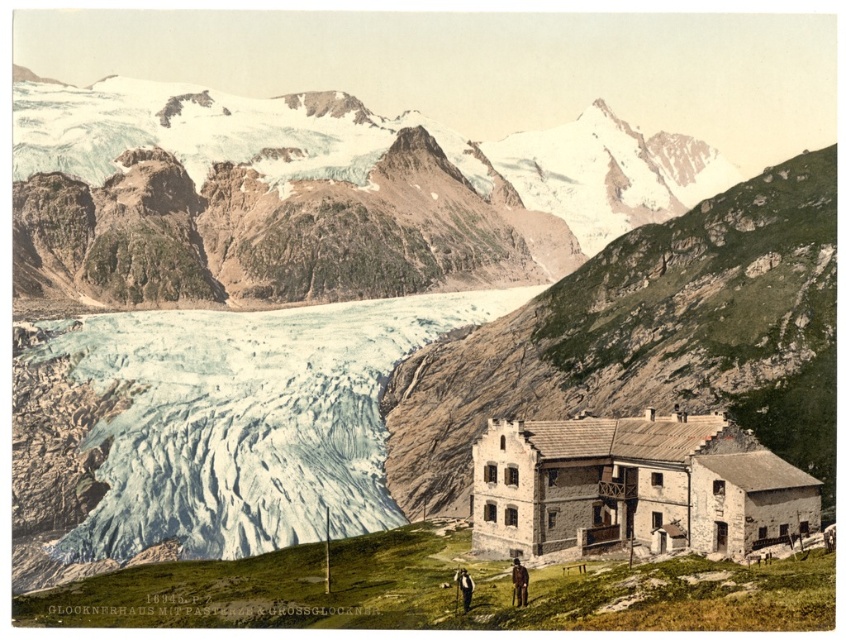
Who is more forward, (x=596, y=109) or (x=515, y=602)?

Point (x=515, y=602) is more forward.

Which of these two, snowy rocky mountain at upper center or brown leather jacket at lower right, stands shorter?

brown leather jacket at lower right

Who is more distant from viewer, (682,156) or (520,596)?

Positioned behind is point (682,156).

The height and width of the screenshot is (640, 846). I want to click on snowy rocky mountain at upper center, so click(x=316, y=196).

Consider the image. Does brown leather jacket at lower right appear on the left side of dark gray wool jacket at lower center?

Incorrect, brown leather jacket at lower right is not on the left side of dark gray wool jacket at lower center.

Is brown leather jacket at lower right wider than dark gray wool jacket at lower center?

Correct, the width of brown leather jacket at lower right exceeds that of dark gray wool jacket at lower center.

At what (x,y) coordinates should I click in order to perform the action: click on brown leather jacket at lower right. Please return your answer as a coordinate pair (x, y). Looking at the image, I should click on 519,582.

Measure the distance between stone textured building at center and camera.

stone textured building at center is 86.16 meters from camera.

Which of these two, stone textured building at center or brown leather jacket at lower right, stands shorter?

Standing shorter between the two is brown leather jacket at lower right.

The height and width of the screenshot is (640, 846). I want to click on stone textured building at center, so click(x=647, y=339).

This screenshot has height=640, width=846. Find the location of `stone textured building at center`. stone textured building at center is located at coordinates click(647, 339).